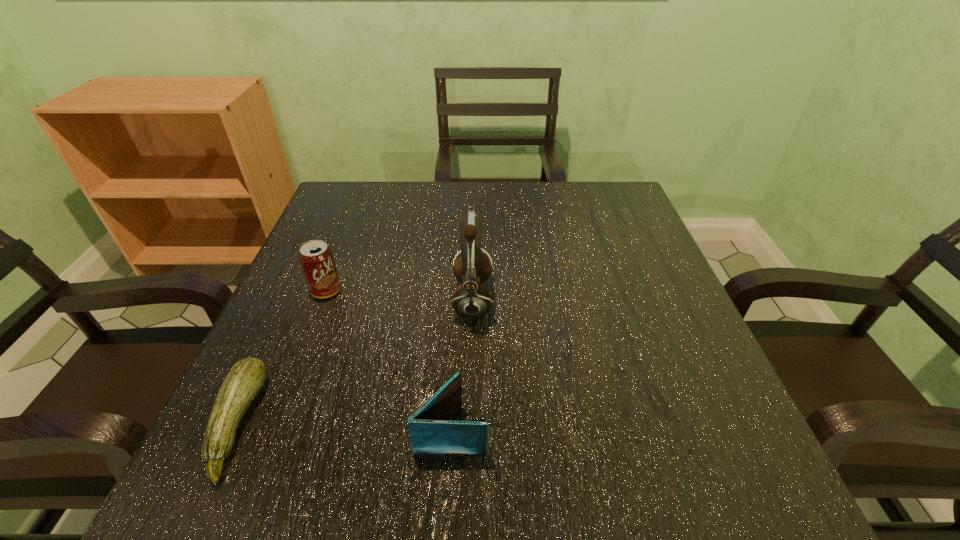
Image resolution: width=960 pixels, height=540 pixels. I want to click on earphone, so click(x=471, y=300).

You are a GUI agent. You are given a task and a screenshot of the screen. Output one action in this format:
    pyautogui.click(x=<x>, y=<y>)
    Task: Click on the third shortest object
    
    Given the screenshot: What is the action you would take?
    pyautogui.click(x=316, y=258)

Identify the location of soda can. (316, 258).

In order to click on the second shortest object in this screenshot , I will do [432, 434].

Find the location of a particular element. zucchini is located at coordinates (245, 379).

Where is `the leftmost object`? The width and height of the screenshot is (960, 540). the leftmost object is located at coordinates (245, 379).

Find the location of a particular element. This screenshot has height=540, width=960. vacant space located on the ear pads of the tallest object is located at coordinates (607, 300).

Identify the location of free spot located on the right of the second tallest object. The image size is (960, 540). (525, 291).

Find the location of a particular element. The width and height of the screenshot is (960, 540). blank space located on the exterior surface of the third tallest object is located at coordinates (533, 430).

This screenshot has width=960, height=540. In order to click on vacant space located at the stem end of the leftmost object in this screenshot , I will do `click(313, 423)`.